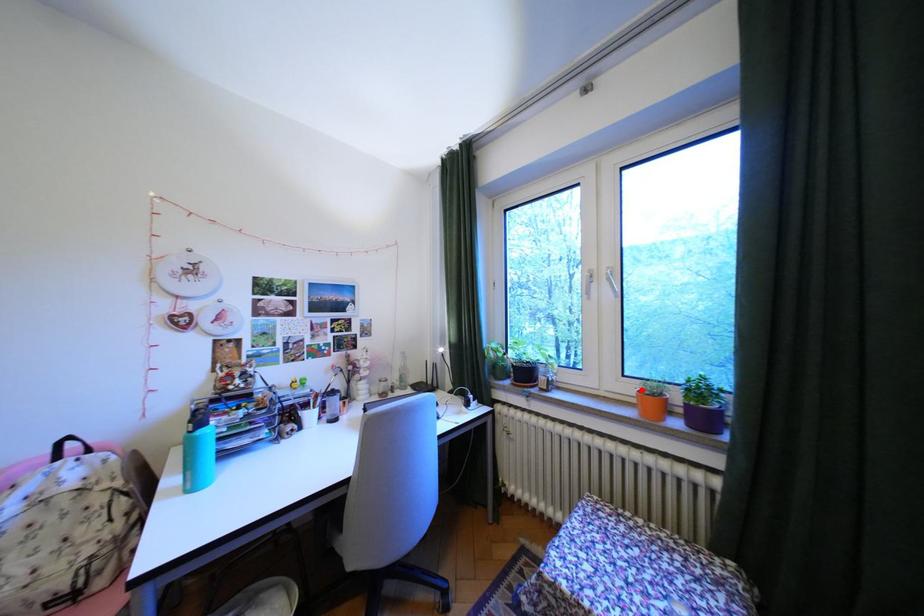
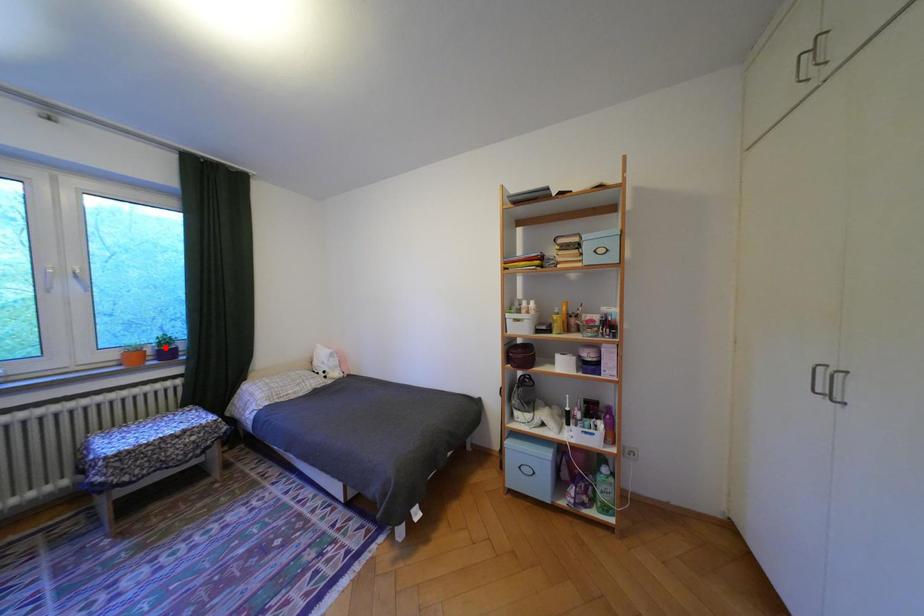
I am providing you with two images of the same scene from different viewpoints. A red point is marked on the first image and another point is marked on the second image. Is the red point in image1 aligned with the point shown in image2?

No